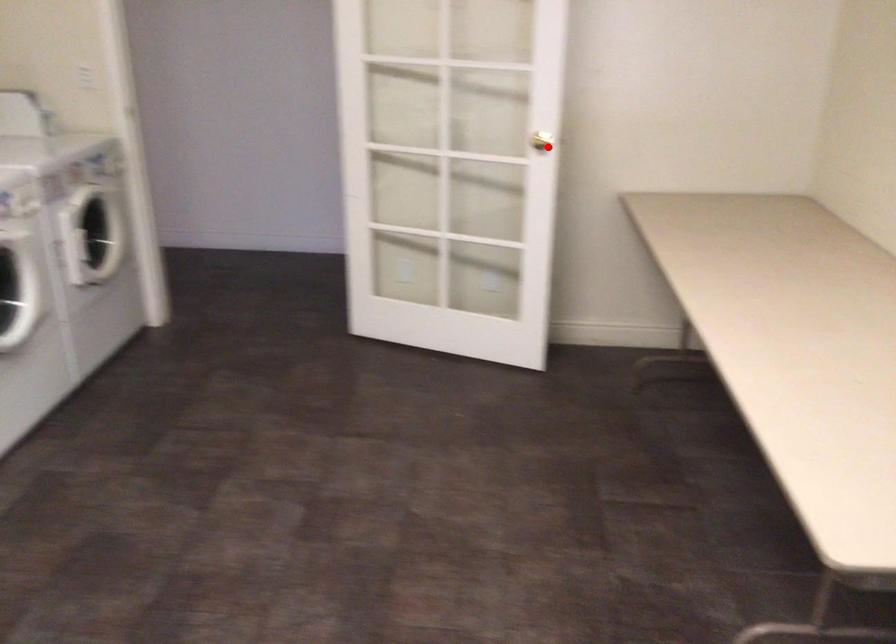
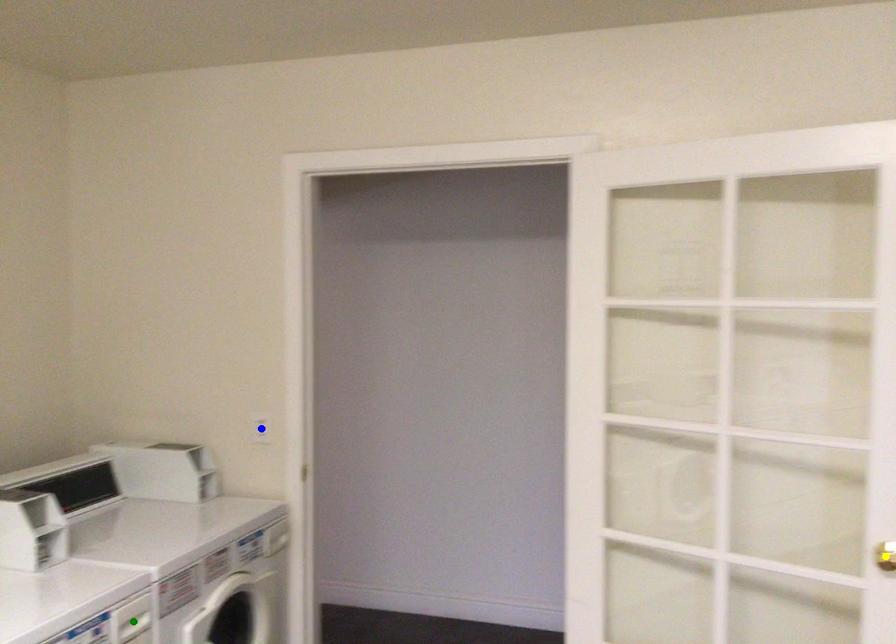
Question: I am providing you with two images of the same scene from different viewpoints. A red point is marked on the first image. You are given multiple points on the second image. Which mark in image 2 goes with the point in image 1?

Choices:
 (A) green point
 (B) yellow point
 (C) blue point

Answer: (B)